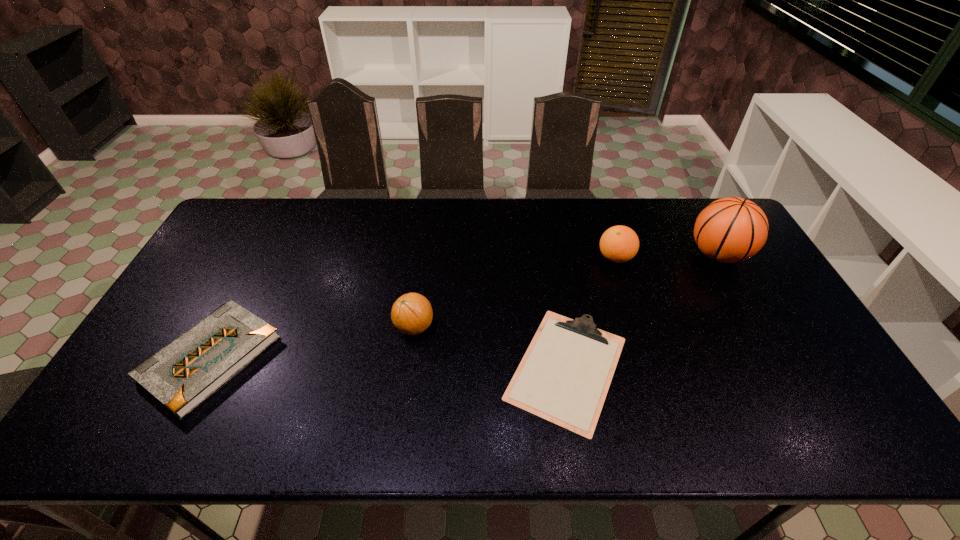
Find the location of `free location located 0.380m on the left of the left orange`. free location located 0.380m on the left of the left orange is located at coordinates (256, 327).

At what (x,y) coordinates should I click in order to perform the action: click on vacant space located on the back of the leftmost object. Please return your answer as a coordinate pair (x, y). The width and height of the screenshot is (960, 540). Looking at the image, I should click on (246, 291).

The image size is (960, 540). In order to click on free space located on the left of the clipboard in this screenshot , I will do `click(442, 368)`.

This screenshot has height=540, width=960. Find the location of `object present at the far edge`. object present at the far edge is located at coordinates [729, 230].

This screenshot has width=960, height=540. I want to click on notebook situated at the near edge, so click(x=185, y=373).

Find the location of a particular element. clipboard at the near edge is located at coordinates (564, 376).

At what (x,y) coordinates should I click in order to perform the action: click on object present at the left edge. Please return your answer as a coordinate pair (x, y). Looking at the image, I should click on (185, 373).

I want to click on object that is at the right edge, so click(x=729, y=230).

Where is `object at the near left corner`? The height and width of the screenshot is (540, 960). object at the near left corner is located at coordinates (185, 373).

You are a GUI agent. You are given a task and a screenshot of the screen. Output one action in this format:
    pyautogui.click(x=<x>, y=<y>)
    Task: Click on the object located in the far right corner section of the desktop
    The width and height of the screenshot is (960, 540).
    Given the screenshot: What is the action you would take?
    pyautogui.click(x=729, y=230)